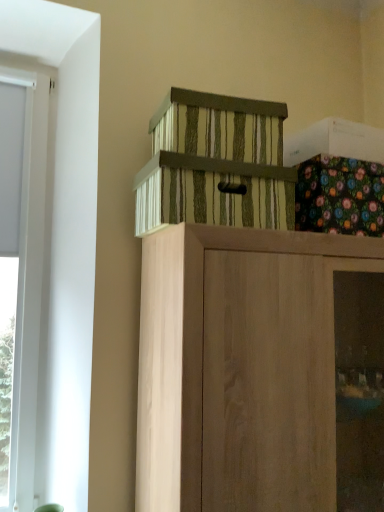
Describe the element at coordinates (240, 367) in the screenshot. I see `wooden cabinet at center, positioned as the 1th cabinetry in bottom-to-top order` at that location.

Find the location of a particular element. The height and width of the screenshot is (512, 384). wooden cabinet at center, which ranks as the second cabinetry in top-to-bottom order is located at coordinates (240, 367).

The width and height of the screenshot is (384, 512). I want to click on striped cardboard box at upper center, positioned as the 2th cabinetry in bottom-to-top order, so (215, 164).

Based on their positions, is wooden cabinet at center, which ranks as the second cabinetry in top-to-bottom order, located to the left or right of floral fabric box at upper right?

wooden cabinet at center, which ranks as the second cabinetry in top-to-bottom order, is to the left of floral fabric box at upper right.

From the image's perspective, which one is positioned lower, wooden cabinet at center, which ranks as the second cabinetry in top-to-bottom order, or floral fabric box at upper right?

wooden cabinet at center, which ranks as the second cabinetry in top-to-bottom order, appears lower in the image.

Which is closer to the camera, (146, 323) or (334, 183)?

Point (146, 323) is positioned farther from the camera compared to point (334, 183).

Considering their positions, is wooden cabinet at center, positioned as the 1th cabinetry in bottom-to-top order, located in front of or behind floral fabric box at upper right?

Clearly, wooden cabinet at center, positioned as the 1th cabinetry in bottom-to-top order, is in front of floral fabric box at upper right.

In the scene shown: Is striped cardboard box at upper center, arranged as the first cabinetry when viewed from the top, turned away from wooden cabinet at center, which ranks as the second cabinetry in top-to-bottom order?

No, striped cardboard box at upper center, arranged as the first cabinetry when viewed from the top, is not facing the opposite direction of wooden cabinet at center, which ranks as the second cabinetry in top-to-bottom order.

Between striped cardboard box at upper center, positioned as the 2th cabinetry in bottom-to-top order, and wooden cabinet at center, positioned as the 1th cabinetry in bottom-to-top order, which one has smaller width?

With smaller width is striped cardboard box at upper center, positioned as the 2th cabinetry in bottom-to-top order.

Does striped cardboard box at upper center, arranged as the first cabinetry when viewed from the top, have a larger size compared to wooden cabinet at center, which ranks as the second cabinetry in top-to-bottom order?

Actually, striped cardboard box at upper center, arranged as the first cabinetry when viewed from the top, might be smaller than wooden cabinet at center, which ranks as the second cabinetry in top-to-bottom order.

Based on the photo, what's the angular difference between floral fabric box at upper right and striped cardboard box at upper center, arranged as the first cabinetry when viewed from the top,'s facing directions?

There is a 4.96-degree angle between the facing directions of floral fabric box at upper right and striped cardboard box at upper center, arranged as the first cabinetry when viewed from the top.

Is floral fabric box at upper right closer to camera compared to striped cardboard box at upper center, positioned as the 2th cabinetry in bottom-to-top order?

No, floral fabric box at upper right is further to the viewer.

Which of these two, floral fabric box at upper right or striped cardboard box at upper center, arranged as the first cabinetry when viewed from the top, stands shorter?

striped cardboard box at upper center, arranged as the first cabinetry when viewed from the top.

Considering the positions of objects striped cardboard box at upper center, positioned as the 2th cabinetry in bottom-to-top order, and floral fabric box at upper right in the image provided, who is more to the right, striped cardboard box at upper center, positioned as the 2th cabinetry in bottom-to-top order, or floral fabric box at upper right?

Positioned to the right is floral fabric box at upper right.

From the image's perspective, is striped cardboard box at upper center, arranged as the first cabinetry when viewed from the top, on floral fabric box at upper right?

Yes, from the image's perspective, striped cardboard box at upper center, arranged as the first cabinetry when viewed from the top, is above floral fabric box at upper right.

Can you tell me how much striped cardboard box at upper center, arranged as the first cabinetry when viewed from the top, and floral fabric box at upper right differ in facing direction?

They differ by 4.96 degrees in their facing directions.

Locate an element on the screen. The image size is (384, 512). the 2nd cabinetry in front of the floral fabric box at upper right, counting from the anchor's position is located at coordinates (240, 367).

Is wooden cabinet at center, positioned as the 1th cabinetry in bottom-to-top order, at the back of floral fabric box at upper right?

No, wooden cabinet at center, positioned as the 1th cabinetry in bottom-to-top order, is not at the back of floral fabric box at upper right.

Can you confirm if floral fabric box at upper right is positioned to the right of wooden cabinet at center, which ranks as the second cabinetry in top-to-bottom order?

Indeed, floral fabric box at upper right is positioned on the right side of wooden cabinet at center, which ranks as the second cabinetry in top-to-bottom order.

Is floral fabric box at upper right next to wooden cabinet at center, which ranks as the second cabinetry in top-to-bottom order, and touching it?

floral fabric box at upper right is not next to wooden cabinet at center, which ranks as the second cabinetry in top-to-bottom order, and they're not touching.

Consider the image. Is wooden cabinet at center, which ranks as the second cabinetry in top-to-bottom order, located outside striped cardboard box at upper center, positioned as the 2th cabinetry in bottom-to-top order?

Indeed, wooden cabinet at center, which ranks as the second cabinetry in top-to-bottom order, is completely outside striped cardboard box at upper center, positioned as the 2th cabinetry in bottom-to-top order.

Does point (332, 406) come in front of point (266, 193)?

No, it is behind (266, 193).

From a real-world perspective, is wooden cabinet at center, positioned as the 1th cabinetry in bottom-to-top order, positioned above or below striped cardboard box at upper center, arranged as the first cabinetry when viewed from the top?

wooden cabinet at center, positioned as the 1th cabinetry in bottom-to-top order, is situated lower than striped cardboard box at upper center, arranged as the first cabinetry when viewed from the top, in the real world.

Is wooden cabinet at center, positioned as the 1th cabinetry in bottom-to-top order, placed right next to striped cardboard box at upper center, arranged as the first cabinetry when viewed from the top?

Result: No, wooden cabinet at center, positioned as the 1th cabinetry in bottom-to-top order, is not next to striped cardboard box at upper center, arranged as the first cabinetry when viewed from the top.

Locate an element on the screen. The image size is (384, 512). the 1st cabinetry counting from the left of the floral fabric box at upper right is located at coordinates click(x=240, y=367).

Where is `cabinetry above the wooden cabinet at center, positioned as the 1th cabinetry in bottom-to-top order (from the image's perspective)`? cabinetry above the wooden cabinet at center, positioned as the 1th cabinetry in bottom-to-top order (from the image's perspective) is located at coordinates (215, 164).

Looking at this image, looking at the image, which one is located closer to floral fabric box at upper right, wooden cabinet at center, which ranks as the second cabinetry in top-to-bottom order, or striped cardboard box at upper center, positioned as the 2th cabinetry in bottom-to-top order?

Among the two, striped cardboard box at upper center, positioned as the 2th cabinetry in bottom-to-top order, is located nearer to floral fabric box at upper right.

Which object lies nearer to the anchor point wooden cabinet at center, which ranks as the second cabinetry in top-to-bottom order, floral fabric box at upper right or striped cardboard box at upper center, positioned as the 2th cabinetry in bottom-to-top order?

Based on the image, striped cardboard box at upper center, positioned as the 2th cabinetry in bottom-to-top order, appears to be nearer to wooden cabinet at center, which ranks as the second cabinetry in top-to-bottom order.

From the image, which object appears to be farther from striped cardboard box at upper center, arranged as the first cabinetry when viewed from the top, wooden cabinet at center, which ranks as the second cabinetry in top-to-bottom order, or floral fabric box at upper right?

wooden cabinet at center, which ranks as the second cabinetry in top-to-bottom order.

Based on their spatial positions, is floral fabric box at upper right or wooden cabinet at center, positioned as the 1th cabinetry in bottom-to-top order, further from striped cardboard box at upper center, positioned as the 2th cabinetry in bottom-to-top order?

wooden cabinet at center, positioned as the 1th cabinetry in bottom-to-top order, is further to striped cardboard box at upper center, positioned as the 2th cabinetry in bottom-to-top order.

Considering their positions, is striped cardboard box at upper center, arranged as the first cabinetry when viewed from the top, positioned closer to wooden cabinet at center, which ranks as the second cabinetry in top-to-bottom order, than floral fabric box at upper right?

striped cardboard box at upper center, arranged as the first cabinetry when viewed from the top, lies closer to wooden cabinet at center, which ranks as the second cabinetry in top-to-bottom order, than the other object.

From the image, which object appears to be nearer to floral fabric box at upper right, striped cardboard box at upper center, positioned as the 2th cabinetry in bottom-to-top order, or wooden cabinet at center, which ranks as the second cabinetry in top-to-bottom order?

striped cardboard box at upper center, positioned as the 2th cabinetry in bottom-to-top order.

I want to click on flower that lies between striped cardboard box at upper center, positioned as the 2th cabinetry in bottom-to-top order, and wooden cabinet at center, which ranks as the second cabinetry in top-to-bottom order, from top to bottom, so click(340, 196).